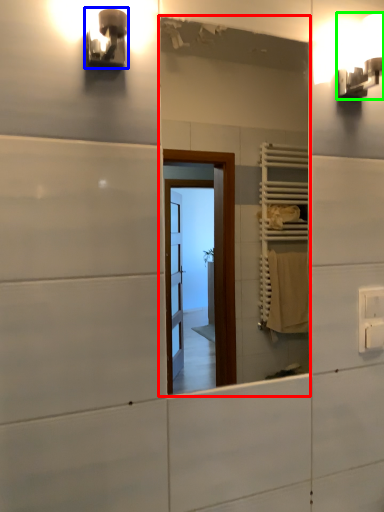
Question: Which is farther away from mirror (highlighted by a red box)? light fixture (highlighted by a blue box) or light fixture (highlighted by a green box)?

Choices:
 (A) light fixture
 (B) light fixture

Answer: (A)